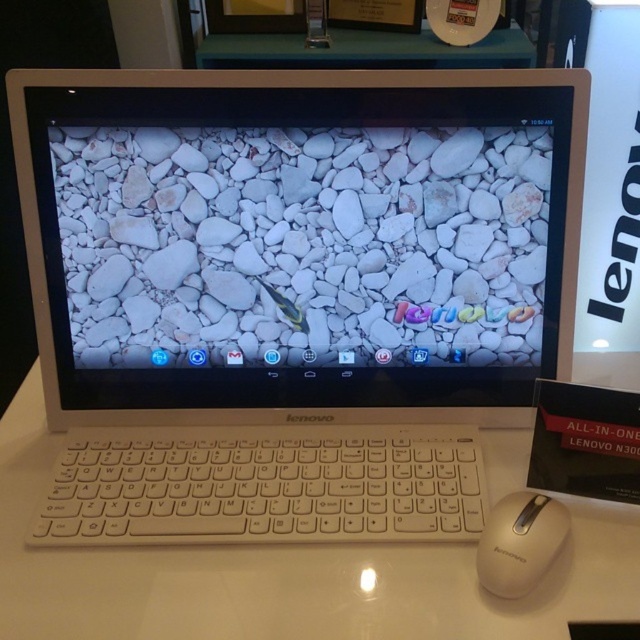
You are setting up a new workspace and need to place a wireless charger on the desk. The wireless charger has a diameter of 10 cm. Can you place it on the desk without overlapping the white matte laptop at center?

The white matte laptop at center is located at point [291,292]. Since the desk surface is light beige or cream color and the laptop is the only object mentioned, you can place the wireless charger anywhere else on the desk that is not overlapping the laptop.

You are setting up a new Lenovo All in One computer and need to place a wireless charger between the white glossy table at center and the white plastic keyboard at center. The charger requires at least 1 inch of space to function properly. Based on the image, will there be enough space between them for the charger?

The white glossy table at center and white plastic keyboard at center are 0.97 inches apart from each other. Since the required space for the wireless charger is 1 inch, there is insufficient space between them to place the charger properly.

You are holding a 12 inch ruler and want to place it on the white glossy table at center. Based on the distance provided, can the ruler fit entirely on the table without hanging off the edge?

The white glossy table at center is 22.77 inches from the viewer. Since the ruler is 12 inches long, it can fit entirely on the table as the table is longer than the ruler.